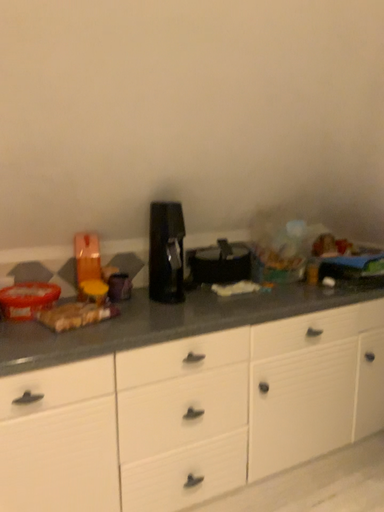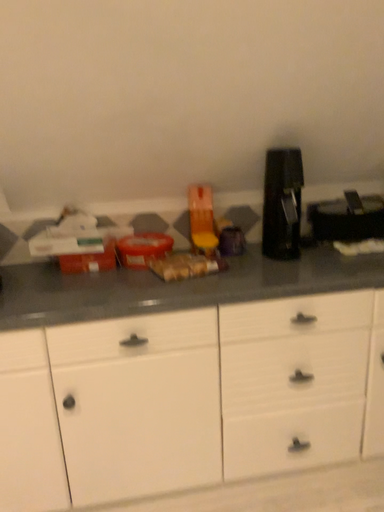
Question: Which way did the camera rotate in the video?

Choices:
 (A) rotated right
 (B) rotated left

Answer: (B)